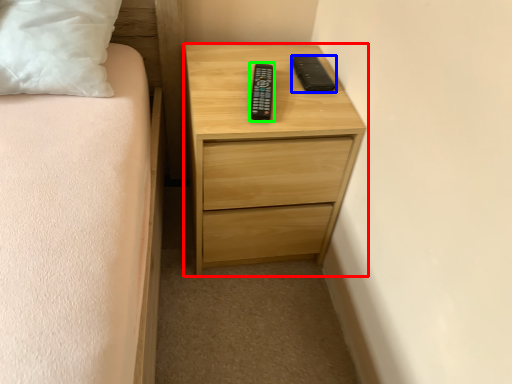
Question: Which object is the closest to the chest of drawers (highlighted by a red box)? Choose among these: gadget (highlighted by a blue box) or control (highlighted by a green box).

Choices:
 (A) gadget
 (B) control

Answer: (B)